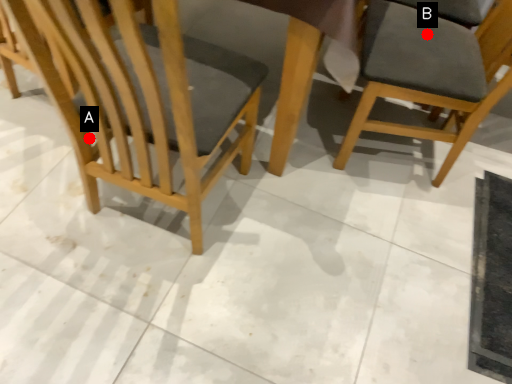
Question: Two points are circled on the image, labeled by A and B beside each circle. Which point is closer to the camera taking this photo?

Choices:
 (A) A is closer
 (B) B is closer

Answer: (A)